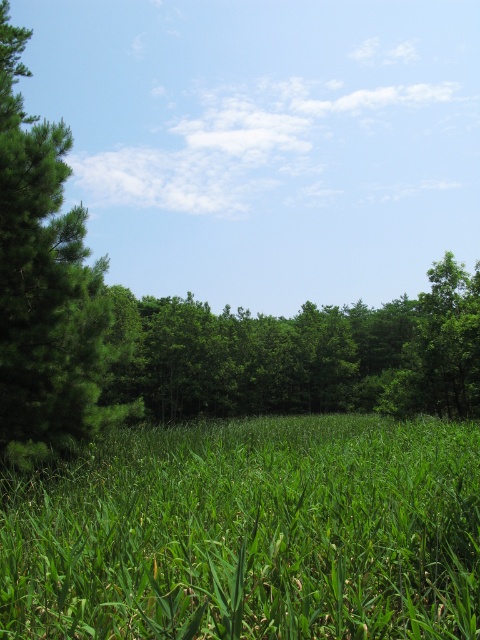
Question: Is green grassy at center in front of green leafy tree at left?

Choices:
 (A) no
 (B) yes

Answer: (B)

Question: Can you confirm if green leafy tree at center is positioned to the left of green leafy tree at left?

Choices:
 (A) yes
 (B) no

Answer: (B)

Question: Is green grassy at center further to camera compared to green leafy tree at left?

Choices:
 (A) yes
 (B) no

Answer: (B)

Question: Among these points, which one is farthest from the camera?

Choices:
 (A) (192, 538)
 (B) (322, 380)
 (C) (45, 284)

Answer: (B)

Question: Which of the following is the closest to the observer?

Choices:
 (A) (148, 355)
 (B) (96, 630)
 (C) (6, 356)

Answer: (B)

Question: Based on their relative distances, which object is farther from the green grassy at center?

Choices:
 (A) green leafy tree at left
 (B) green leafy tree at center

Answer: (B)